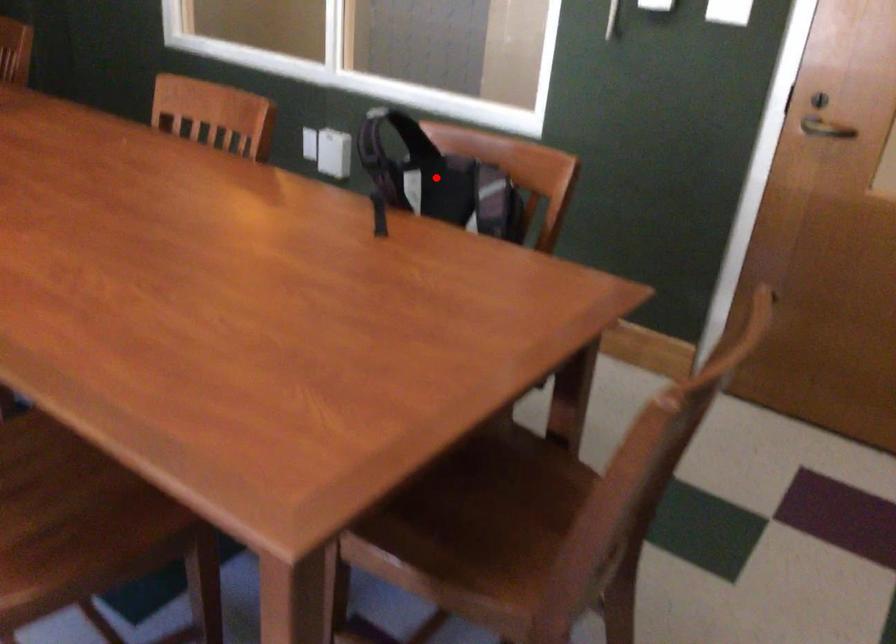
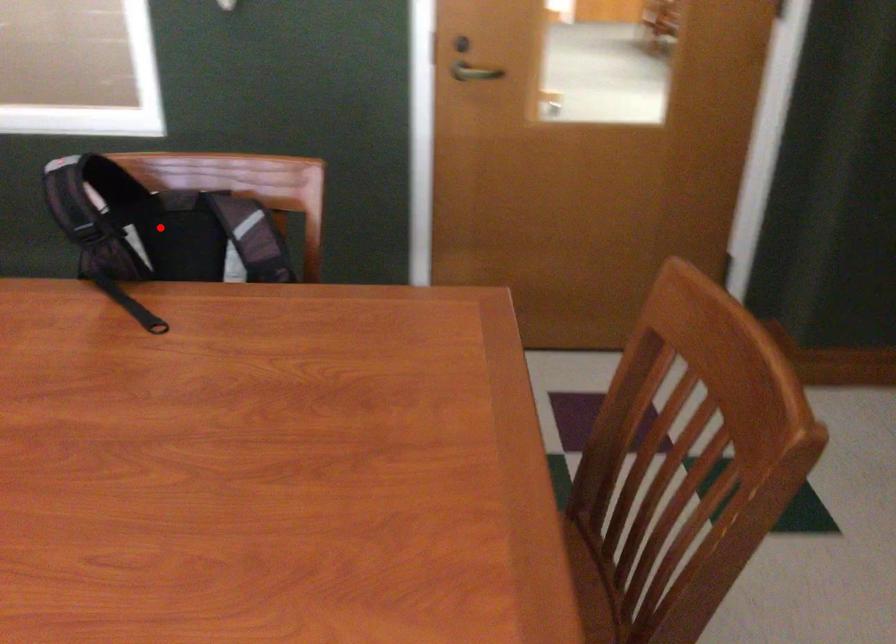
I am providing you with two images of the same scene from different viewpoints. A red point is marked on the first image and another point is marked on the second image. Are the points marked in image1 and image2 representing the same 3D position?

Yes